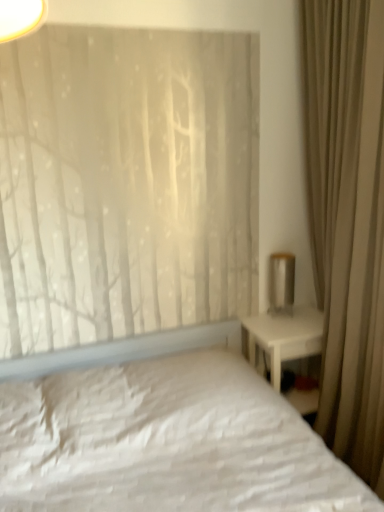
Question: In the image, is beige fabric curtain at right positioned in front of or behind matte white rectangular at upper right?

Choices:
 (A) behind
 (B) front

Answer: (B)

Question: From a real-world perspective, is beige fabric curtain at right above or below matte white rectangular at upper right?

Choices:
 (A) above
 (B) below

Answer: (A)

Question: Looking at their shapes, would you say beige fabric curtain at right is wider or thinner than matte white rectangular at upper right?

Choices:
 (A) thin
 (B) wide

Answer: (B)

Question: Is matte white rectangular at upper right taller or shorter than beige fabric curtain at right?

Choices:
 (A) short
 (B) tall

Answer: (A)

Question: From a real-world perspective, is matte white rectangular at upper right physically located above or below beige fabric curtain at right?

Choices:
 (A) above
 (B) below

Answer: (B)

Question: Looking at their shapes, would you say matte white rectangular at upper right is wider or thinner than beige fabric curtain at right?

Choices:
 (A) thin
 (B) wide

Answer: (A)

Question: Would you say matte white rectangular at upper right is inside or outside beige fabric curtain at right?

Choices:
 (A) outside
 (B) inside

Answer: (B)